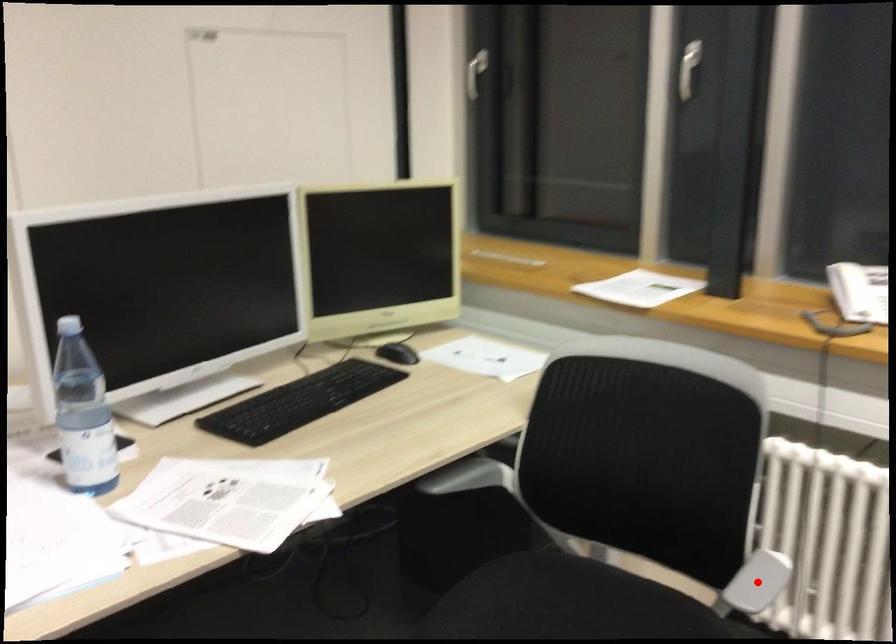
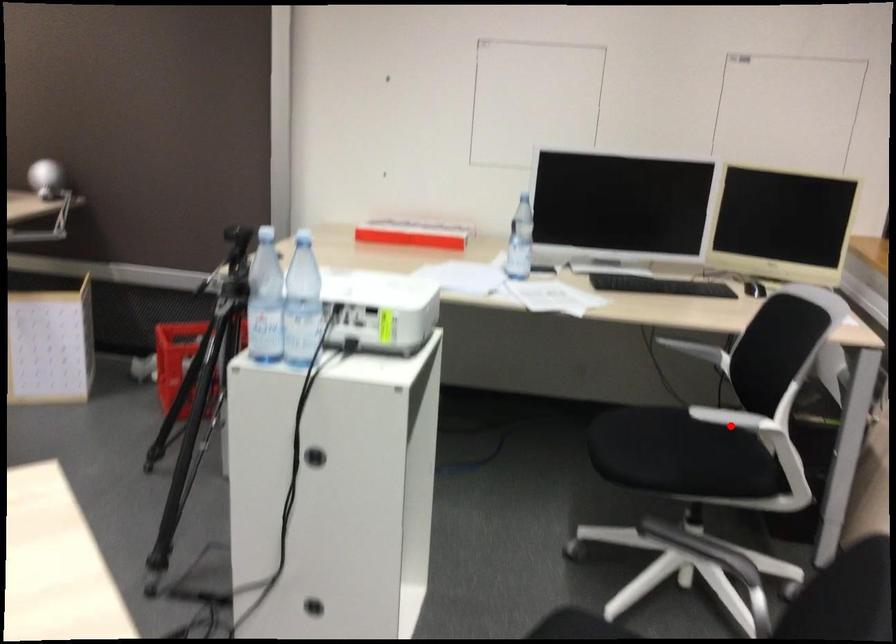
I am providing you with two images of the same scene from different viewpoints. A red point is marked on the first image and another point is marked on the second image. Is the marked point in image1 the same physical position as the marked point in image2?

Yes